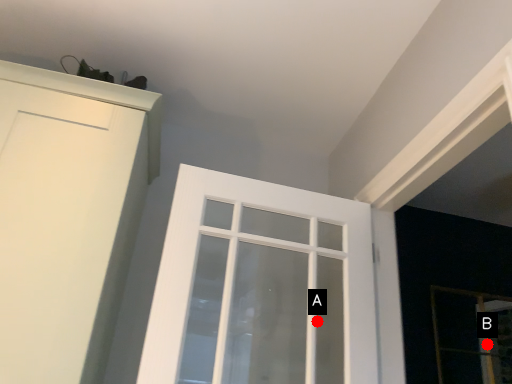
Question: Two points are circled on the image, labeled by A and B beside each circle. Which point is closer to the camera?

Choices:
 (A) A is closer
 (B) B is closer

Answer: (A)